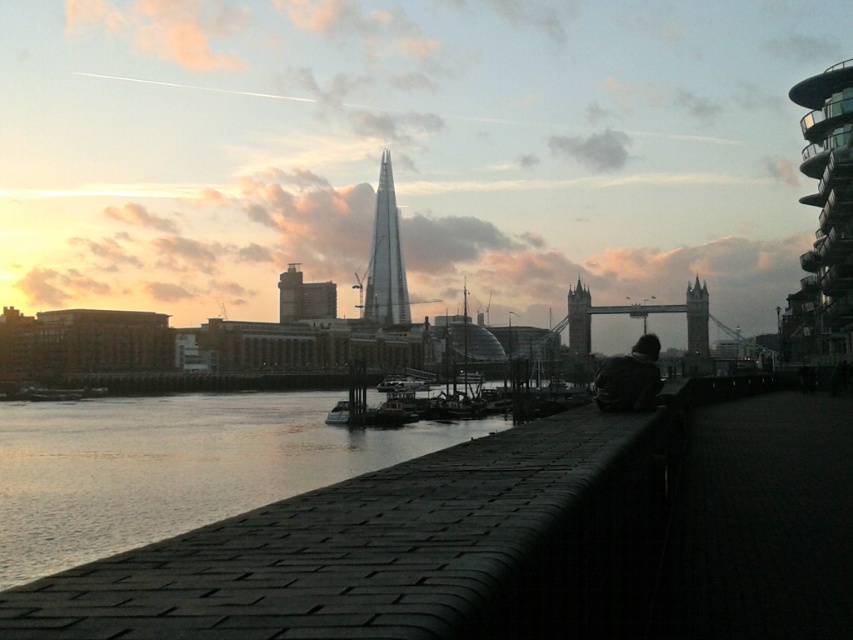
You are standing at the point labeled point (813,294) and want to walk to the point labeled point (372,237). Which direction should you move relative to your current position?

You should move away from the viewer since point (372,237) is farther from the viewer than point (813,294).

Consider the image. You are standing on the walkway near the smooth concrete river at lower left and want to cross to the glassy steel tower at center. Which direction should you walk to reach the tower?

To reach the glassy steel tower at center from the smooth concrete river at lower left, you should walk towards the center of the image since the tower is positioned centrally and the river is at the lower left.

You are standing on the paved walkway and want to take a photo of both the stone gray tower at center and the metallic silver boat at center. Which object should you zoom in on to ensure both fit in the frame?

Since the stone gray tower at center might be wider than the metallic silver boat at center, you should zoom in on the stone gray tower at center to ensure both fit in the frame.